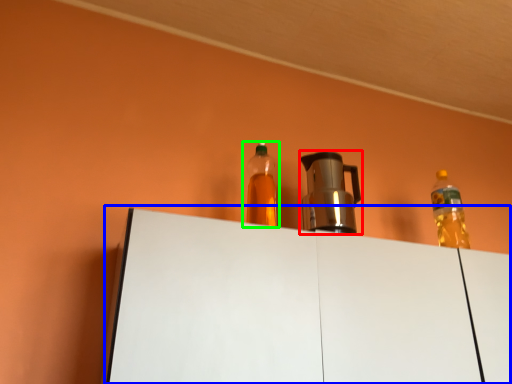
Question: Considering the real-world distances, which object is closest to coffeepot (highlighted by a red box)? table (highlighted by a blue box) or bottle (highlighted by a green box).

Choices:
 (A) table
 (B) bottle

Answer: (B)